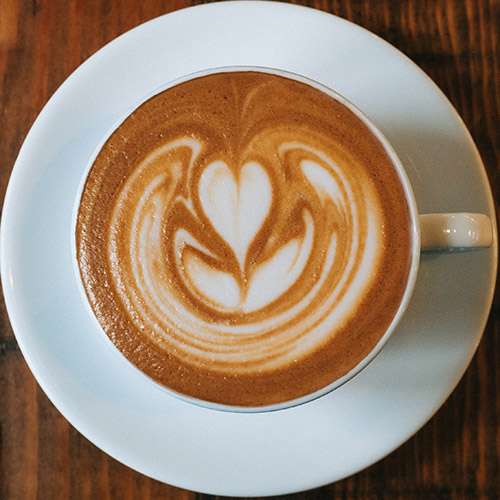
This screenshot has width=500, height=500. What are the coordinates of `right side of cup` in the screenshot? It's located at (414, 228).